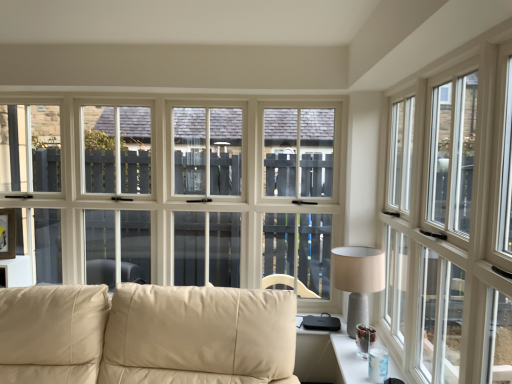
Question: Does point click(x=301, y=340) appear closer or farther from the camera than point click(x=113, y=296)?

Choices:
 (A) closer
 (B) farther

Answer: (B)

Question: Based on their sizes in the image, would you say clear glass table at lower right is bigger or smaller than beige leather couch at lower left?

Choices:
 (A) small
 (B) big

Answer: (A)

Question: Based on their relative distances, which object is nearer to the white glossy window at right?

Choices:
 (A) beige leather couch at lower left
 (B) beige fabric lampshade at right
 (C) clear glass table at lower right

Answer: (B)

Question: Which of these objects is positioned closest to the beige leather couch at lower left?

Choices:
 (A) white glossy window at right
 (B) clear glass table at lower right
 (C) beige fabric lampshade at right

Answer: (B)